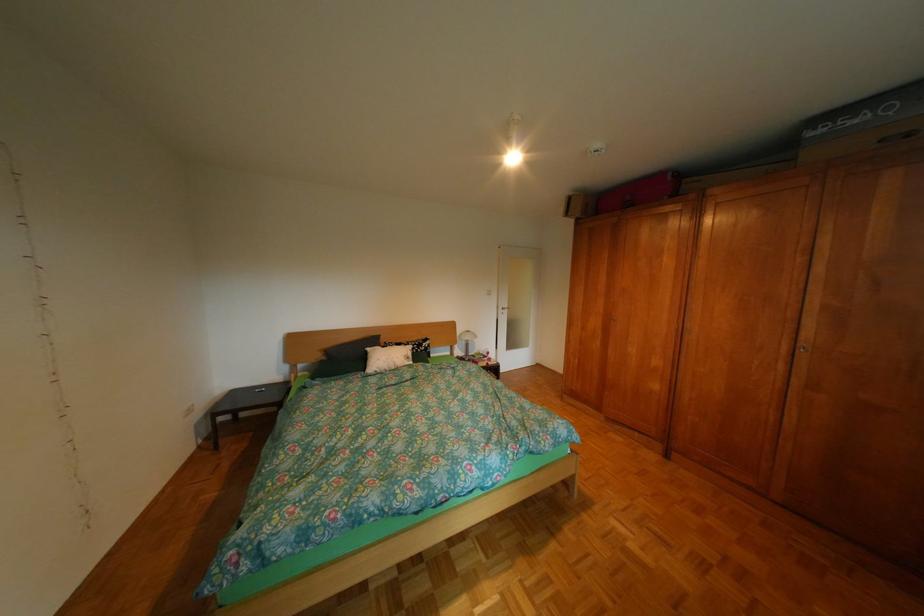
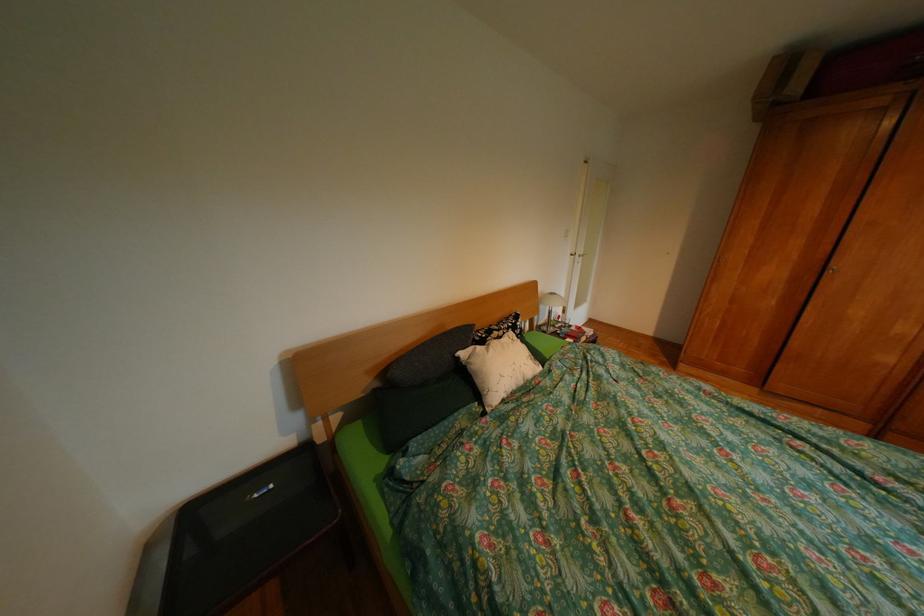
What movement of the cameraman would produce the second image?

The movement direction of the cameraman is left, forward.